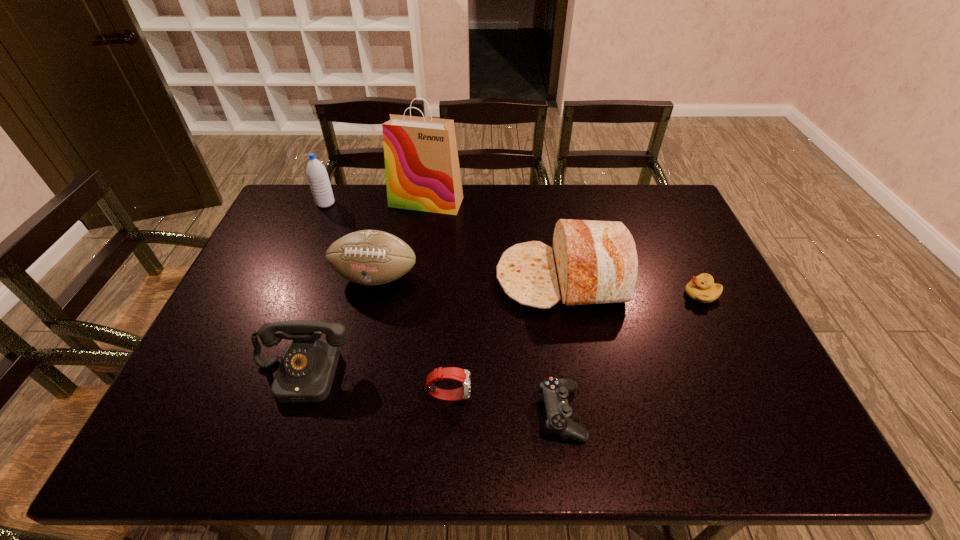
In order to click on vacant space situated 0.200m on the left of the shortest object in this screenshot , I will do `click(450, 413)`.

Identify the location of shopping bag located at the far edge. coord(422,169).

Locate an element on the screen. water bottle present at the far edge is located at coordinates (318, 179).

You are a GUI agent. You are given a task and a screenshot of the screen. Output one action in this format:
    pyautogui.click(x=<x>, y=<y>)
    Task: Click on the object at the near edge
    This screenshot has height=540, width=960.
    Given the screenshot: What is the action you would take?
    pyautogui.click(x=559, y=414)

At what (x,y) coordinates should I click in order to perform the action: click on water bottle at the left edge. Please return your answer as a coordinate pair (x, y). This screenshot has height=540, width=960. Looking at the image, I should click on (318, 179).

At what (x,y) coordinates should I click in order to perform the action: click on telephone that is at the left edge. Please return your answer as a coordinate pair (x, y). The height and width of the screenshot is (540, 960). Looking at the image, I should click on (305, 375).

You are a GUI agent. You are given a task and a screenshot of the screen. Output one action in this format:
    pyautogui.click(x=<x>, y=<y>)
    Task: Click on the object situated at the right edge
    The image size is (960, 540).
    Given the screenshot: What is the action you would take?
    pyautogui.click(x=702, y=288)

Locate an element on the screen. object located in the far left corner section of the desktop is located at coordinates (318, 179).

Locate an element on the screen. free space at the far edge of the desktop is located at coordinates (521, 219).

You are a GUI agent. You are given a task and a screenshot of the screen. Output one action in this format:
    pyautogui.click(x=<x>, y=<y>)
    Task: Click on the vacant space at the near edge of the desktop
    
    Given the screenshot: What is the action you would take?
    pyautogui.click(x=722, y=432)